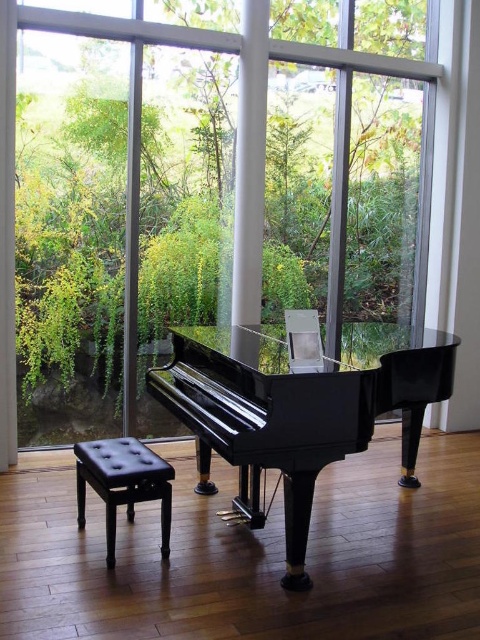
Question: Which object is positioned farthest from the black leather stool at lower left?

Choices:
 (A) transparent glass window at center
 (B) glossy black piano at center

Answer: (A)

Question: Is glossy black piano at center to the left of transparent glass window at center from the viewer's perspective?

Choices:
 (A) no
 (B) yes

Answer: (A)

Question: Which point is closer to the camera?

Choices:
 (A) (168, 480)
 (B) (260, 205)

Answer: (A)

Question: Does glossy black piano at center appear over black leather stool at lower left?

Choices:
 (A) no
 (B) yes

Answer: (B)

Question: Does glossy black piano at center appear over black leather stool at lower left?

Choices:
 (A) no
 (B) yes

Answer: (B)

Question: Which point appears farthest from the camera in this image?

Choices:
 (A) 124,22
 (B) 296,428

Answer: (A)